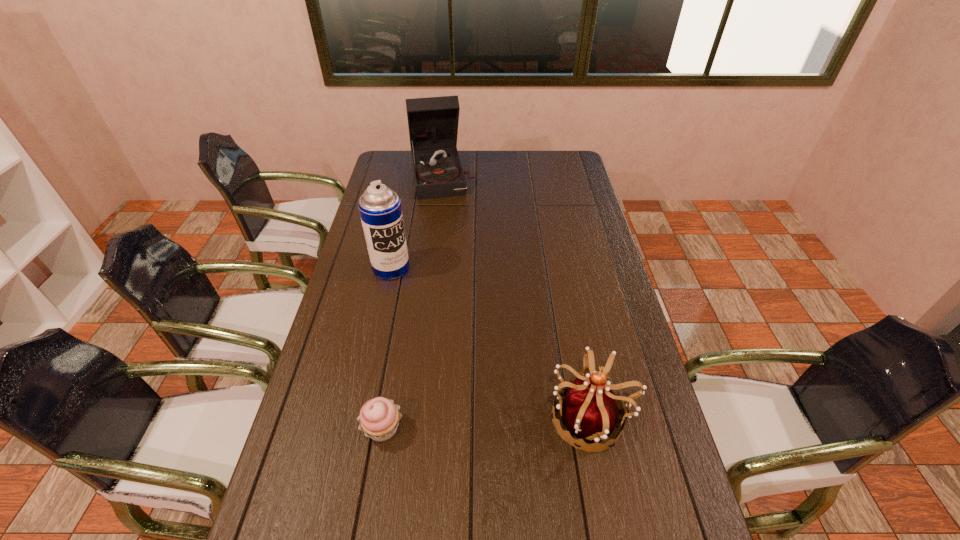
Locate an element on the screen. blank area located on the label side of the third nearest object is located at coordinates (450, 342).

Find the location of a particular element. vacant space located 0.320m on the label side of the third nearest object is located at coordinates (448, 340).

The height and width of the screenshot is (540, 960). Identify the location of vacant space located on the front-facing side of the farthest object. (452, 225).

You are a GUI agent. You are given a task and a screenshot of the screen. Output one action in this format:
    pyautogui.click(x=<x>, y=<y>)
    Task: Click on the vacant space located on the front-facing side of the farthest object
    The height and width of the screenshot is (540, 960).
    Given the screenshot: What is the action you would take?
    pyautogui.click(x=450, y=218)

Identify the location of free space located 0.280m on the front-facing side of the farthest object. (455, 241).

What are the coordinates of `object at the far edge` in the screenshot? It's located at click(433, 122).

Locate an element on the screen. This screenshot has width=960, height=540. cupcake that is at the left edge is located at coordinates (379, 418).

Where is `aerosol can that is at the left edge`? aerosol can that is at the left edge is located at coordinates (380, 210).

Locate an element on the screen. phonograph_record positioned at the left edge is located at coordinates (433, 122).

Identify the location of object that is at the right edge. Image resolution: width=960 pixels, height=540 pixels. (590, 410).